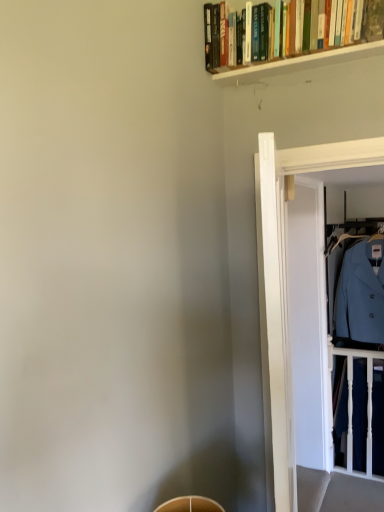
Question: From the image's perspective, is white wooden balustrade at right over light blue woolen coat at right?

Choices:
 (A) no
 (B) yes

Answer: (A)

Question: Does white wooden balustrade at right lie in front of light blue woolen coat at right?

Choices:
 (A) yes
 (B) no

Answer: (B)

Question: Is white wooden balustrade at right bigger than light blue woolen coat at right?

Choices:
 (A) no
 (B) yes

Answer: (A)

Question: Is light blue woolen coat at right at the back of white wooden balustrade at right?

Choices:
 (A) no
 (B) yes

Answer: (A)

Question: From a real-world perspective, is white wooden balustrade at right on top of light blue woolen coat at right?

Choices:
 (A) no
 (B) yes

Answer: (A)

Question: Is white wooden balustrade at right outside of light blue woolen coat at right?

Choices:
 (A) yes
 (B) no

Answer: (A)

Question: From the image's perspective, is light blue woolen coat at right beneath transparent glass door at right?

Choices:
 (A) yes
 (B) no

Answer: (B)

Question: Could transparent glass door at right be considered to be inside light blue woolen coat at right?

Choices:
 (A) yes
 (B) no

Answer: (B)

Question: Does light blue woolen coat at right appear on the left side of transparent glass door at right?

Choices:
 (A) no
 (B) yes

Answer: (A)

Question: Are light blue woolen coat at right and transparent glass door at right far apart?

Choices:
 (A) yes
 (B) no

Answer: (A)

Question: Can you confirm if light blue woolen coat at right is thinner than transparent glass door at right?

Choices:
 (A) no
 (B) yes

Answer: (A)

Question: Is light blue woolen coat at right further to camera compared to transparent glass door at right?

Choices:
 (A) yes
 (B) no

Answer: (A)

Question: Does white wooden balustrade at right lie in front of transparent glass door at right?

Choices:
 (A) yes
 (B) no

Answer: (B)